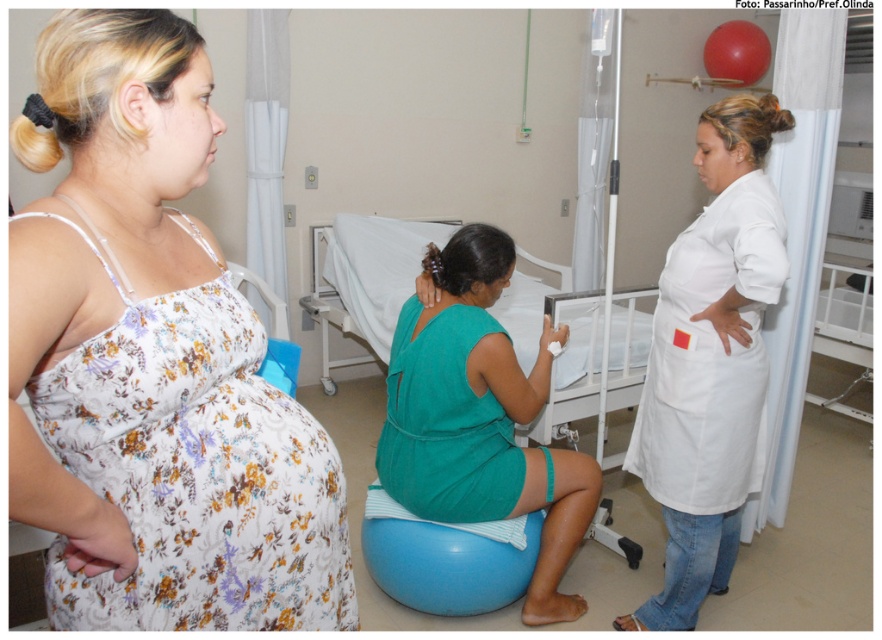
You are a patient in this hospital scene and need to locate two specific points marked in the image. Which of the two points, point (x=674, y=540) or point (x=529, y=304), is nearer to you as you stand in the scene?

Point (x=674, y=540) is closer to the viewer than point (x=529, y=304).